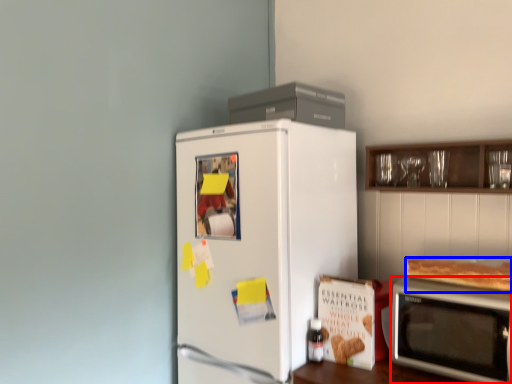
Question: Among these objects, which one is nearest to the camera, microwave oven (highlighted by a red box) or food (highlighted by a blue box)?

Choices:
 (A) microwave oven
 (B) food

Answer: (A)